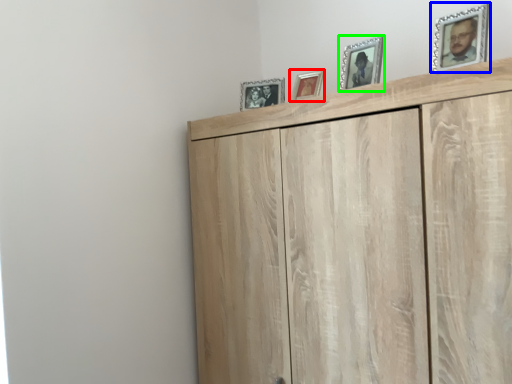
Question: Based on their relative distances, which object is farther from picture frame (highlighted by a red box)? Choose from picture frame (highlighted by a blue box) and picture frame (highlighted by a green box).

Choices:
 (A) picture frame
 (B) picture frame

Answer: (A)